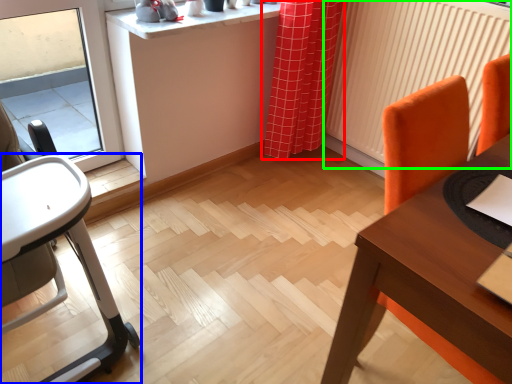
Question: Considering the real-world distances, which object is closest to curtain (highlighted by a red box)? chair (highlighted by a blue box) or radiator (highlighted by a green box).

Choices:
 (A) chair
 (B) radiator

Answer: (B)